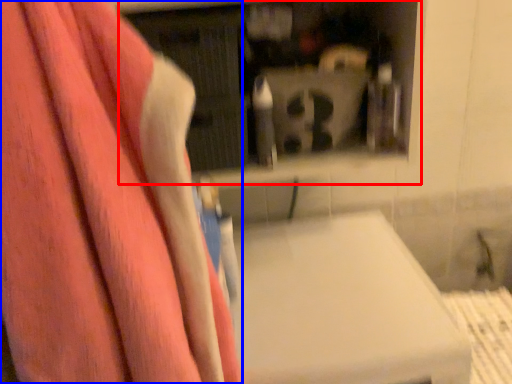
Question: Among these objects, which one is nearest to the camera, shelf (highlighted by a red box) or towel (highlighted by a blue box)?

Choices:
 (A) shelf
 (B) towel

Answer: (B)